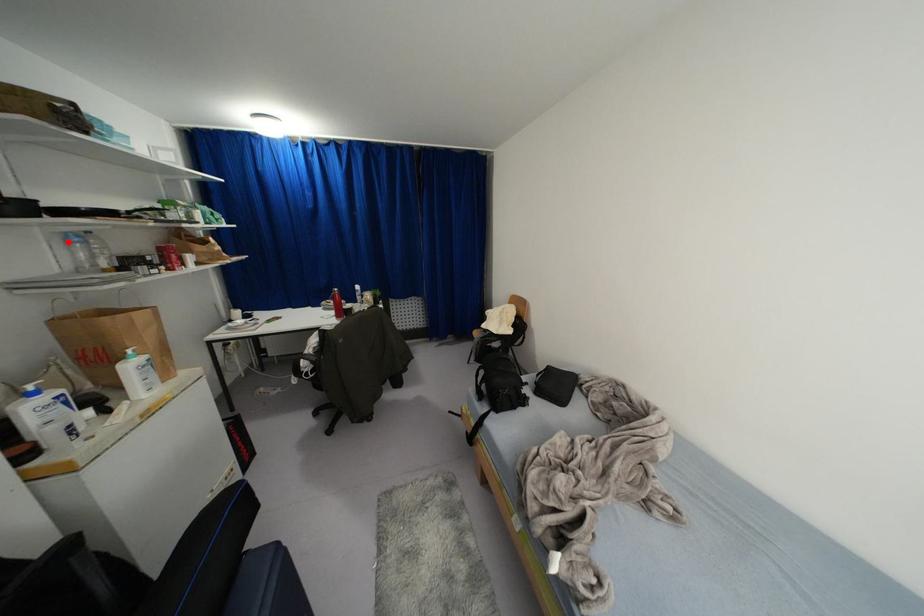
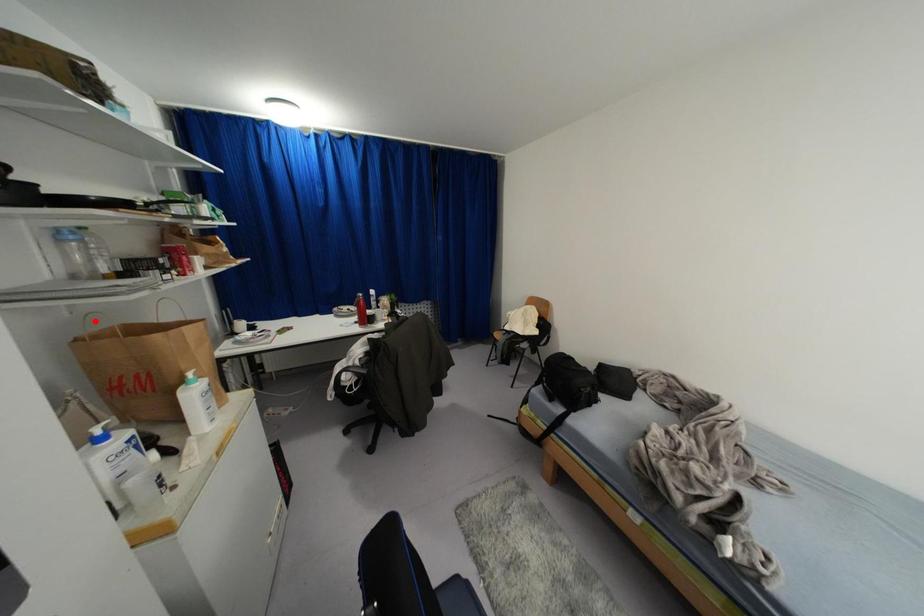
I am providing you with two images of the same scene from different viewpoints. A red point is marked on the first image and another point is marked on the second image. Is the marked point in image1 the same physical position as the marked point in image2?

No